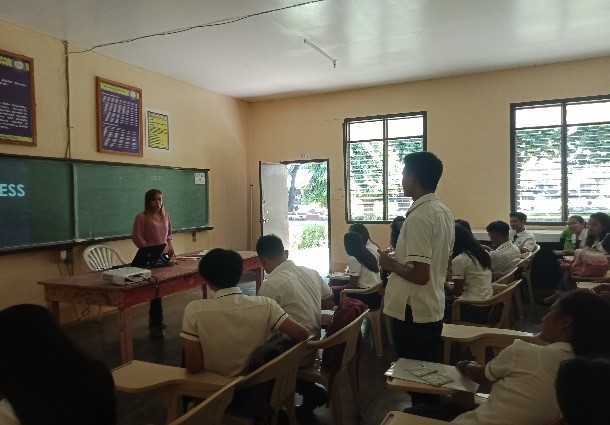
What are the coordinates of `wall` in the screenshot? It's located at (470, 219).